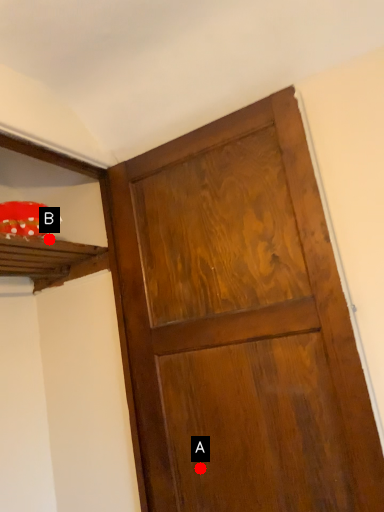
Question: Two points are circled on the image, labeled by A and B beside each circle. Which point is closer to the camera?

Choices:
 (A) A is closer
 (B) B is closer

Answer: (A)